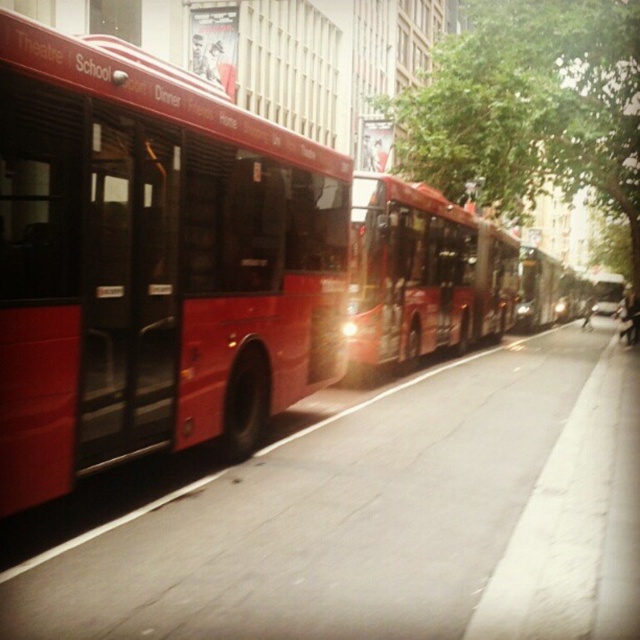
Question: Among these objects, which one is farthest from the camera?

Choices:
 (A) shiny red bus at center
 (B) matte red bus at left

Answer: (A)

Question: Can you confirm if matte red bus at left is positioned above metallic red bus at center?

Choices:
 (A) yes
 (B) no

Answer: (B)

Question: Which object is positioned farthest from the matte red bus at left?

Choices:
 (A) metallic red bus at center
 (B) shiny red bus at center

Answer: (A)

Question: Is shiny red bus at center below metallic red bus at center?

Choices:
 (A) yes
 (B) no

Answer: (B)

Question: Estimate the real-world distances between objects in this image. Which object is farther from the metallic red bus at center?

Choices:
 (A) shiny red bus at center
 (B) matte red bus at left

Answer: (B)

Question: Is shiny red bus at center below metallic red bus at center?

Choices:
 (A) yes
 (B) no

Answer: (B)